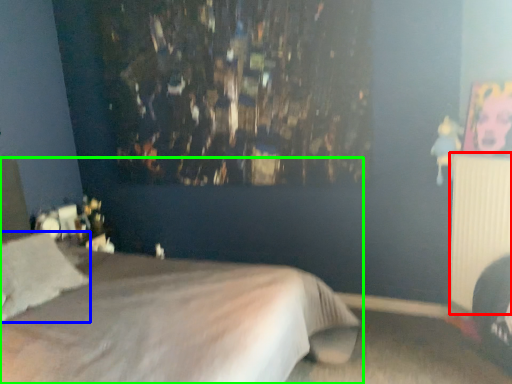
Question: Based on their relative distances, which object is farther from radiator (highlighted by a red box)? Choose from pillow (highlighted by a blue box) and bed (highlighted by a green box).

Choices:
 (A) pillow
 (B) bed

Answer: (A)